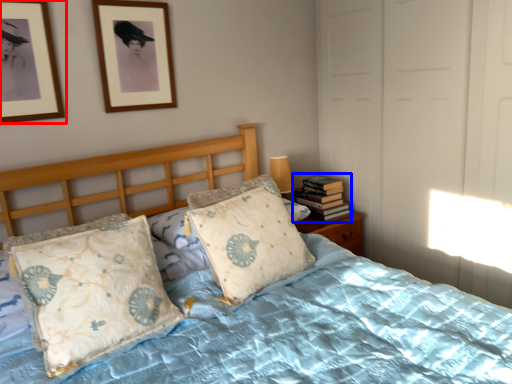
Question: Which point is closer to the camera, picture frame (highlighted by a red box) or book (highlighted by a blue box)?

Choices:
 (A) picture frame
 (B) book

Answer: (A)